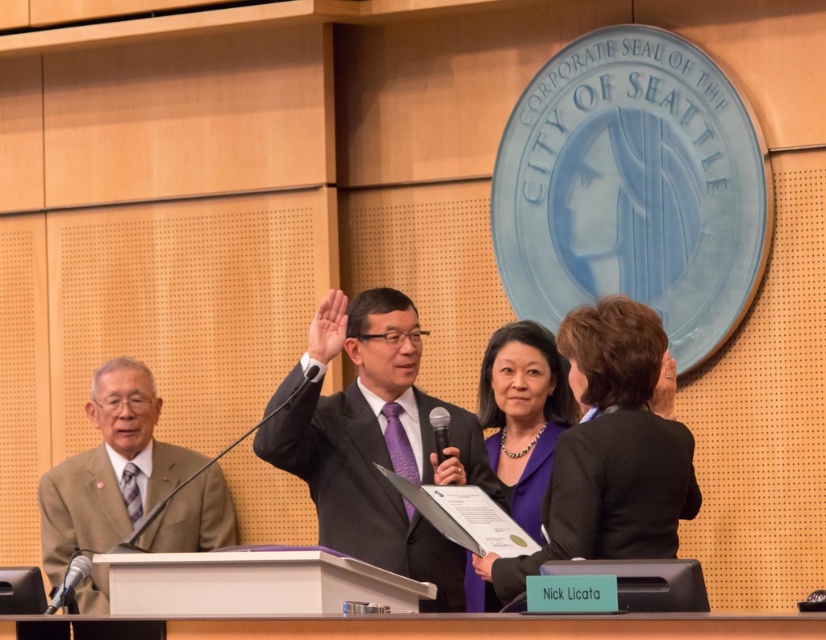
You are an event photographer at the ceremony. You need to capture a closeup shot of the black metallic microphone at lower left and the black plastic microphone at center. Which microphone should you focus on first to ensure it appears larger in the photo?

The black metallic microphone at lower left is in front of the black plastic microphone at center, so focusing on the black metallic microphone at lower left will make it appear larger in the photo.

Looking at this image, you are a photographer at the event and need to capture a clear photo of both the matte black suit at center and the matte black microphone at center. Since both are matte black, how can you ensure they are distinguishable in the photo?

The matte black suit at center is in front of the matte black microphone at center, so positioning the camera slightly to the side will create a slight overlap, making the suit appear in front of the microphone and thus distinguishable.

You are a photographer at the event and need to position your camera to capture both the black metallic microphone at lower left and the black plastic microphone at center in the same frame. Which microphone should you focus on to ensure both are visible without moving the camera?

The black metallic microphone at lower left is shorter than the black plastic microphone at center, so focusing on the taller black plastic microphone at center would allow both to be visible in the frame.